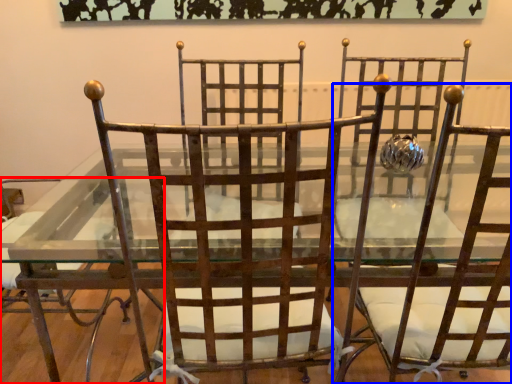
Question: Which object appears farthest to the camera in this image, chair (highlighted by a red box) or chair (highlighted by a blue box)?

Choices:
 (A) chair
 (B) chair

Answer: (A)